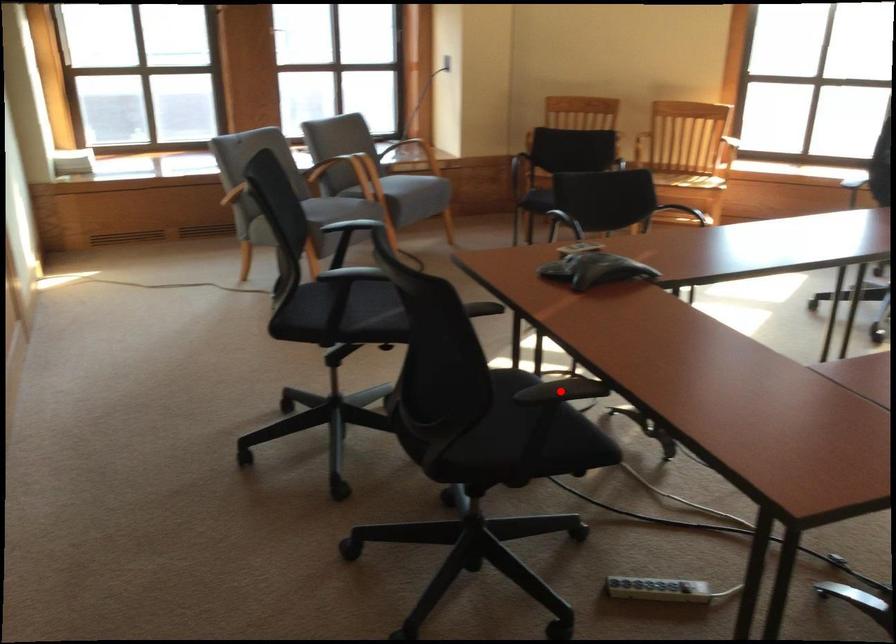
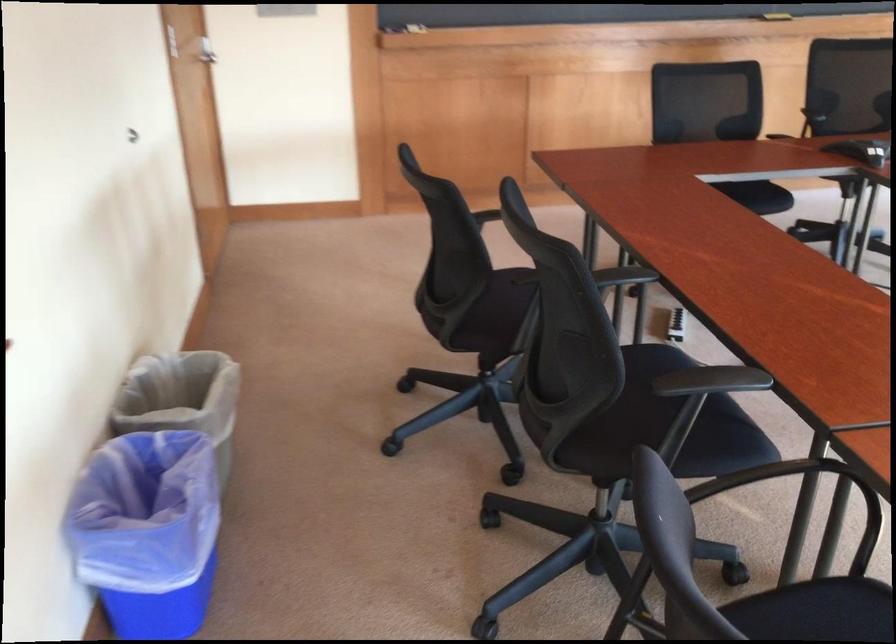
Question: I am providing you with two images of the same scene from different viewpoints. A red point is marked on the first image. Can you still see the location of the red point in image 2?

Choices:
 (A) Yes
 (B) No

Answer: (B)